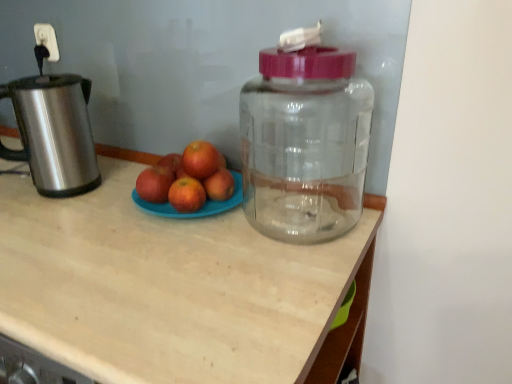
Question: Should I look upward or downward to see red matte grapefruit at center, which is the second grapefruit from top to bottom?

Choices:
 (A) down
 (B) up

Answer: (A)

Question: From the image's perspective, is red matte grapefruit at center, which is the second grapefruit from top to bottom, on top of red matte apple at center, which ranks as the second apple in right-to-left order?

Choices:
 (A) no
 (B) yes

Answer: (A)

Question: Does red matte grapefruit at center, which is the second grapefruit from top to bottom, contain red matte apple at center, the first apple viewed from the left?

Choices:
 (A) yes
 (B) no

Answer: (B)

Question: Is red matte grapefruit at center, which is the second grapefruit from top to bottom, thinner than red matte apple at center, the first apple viewed from the left?

Choices:
 (A) yes
 (B) no

Answer: (A)

Question: Is red matte grapefruit at center, which is the second grapefruit from top to bottom, smaller than red matte apple at center, the first apple viewed from the left?

Choices:
 (A) no
 (B) yes

Answer: (B)

Question: Is red matte grapefruit at center, the first grapefruit when ordered from bottom to top, taller than red matte apple at center, which ranks as the second apple in right-to-left order?

Choices:
 (A) no
 (B) yes

Answer: (A)

Question: Can we say red matte grapefruit at center, the first grapefruit when ordered from bottom to top, lies outside red matte apple at center, the first apple viewed from the left?

Choices:
 (A) no
 (B) yes

Answer: (B)

Question: Can we say brushed metal kettle at left lies outside matte plastic plate of apples at center?

Choices:
 (A) no
 (B) yes

Answer: (B)

Question: Is brushed metal kettle at left to the left of matte plastic plate of apples at center from the viewer's perspective?

Choices:
 (A) no
 (B) yes

Answer: (B)

Question: From the image's perspective, is brushed metal kettle at left under matte plastic plate of apples at center?

Choices:
 (A) no
 (B) yes

Answer: (A)

Question: From a real-world perspective, is brushed metal kettle at left beneath matte plastic plate of apples at center?

Choices:
 (A) no
 (B) yes

Answer: (A)

Question: Can you confirm if brushed metal kettle at left is shorter than matte plastic plate of apples at center?

Choices:
 (A) yes
 (B) no

Answer: (A)

Question: Does brushed metal kettle at left have a smaller size compared to matte plastic plate of apples at center?

Choices:
 (A) yes
 (B) no

Answer: (A)

Question: Does red matte apple at center, acting as the second apple starting from the left, come behind brushed metal kettle at left?

Choices:
 (A) yes
 (B) no

Answer: (A)